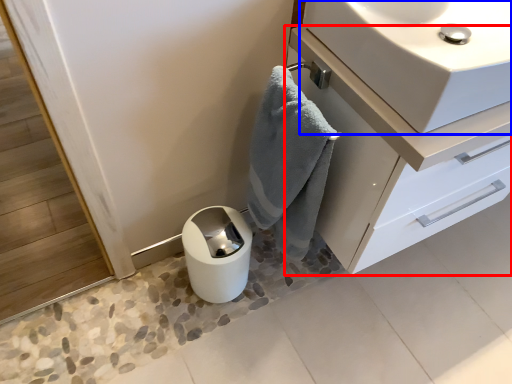
Question: Which object appears farthest to the camera in this image, bathroom cabinet (highlighted by a red box) or sink (highlighted by a blue box)?

Choices:
 (A) bathroom cabinet
 (B) sink

Answer: (A)